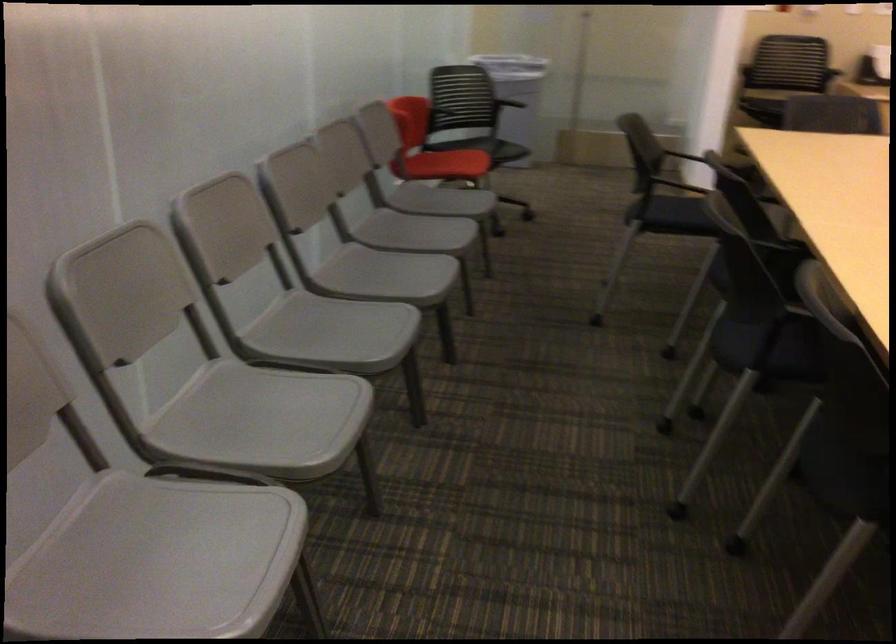
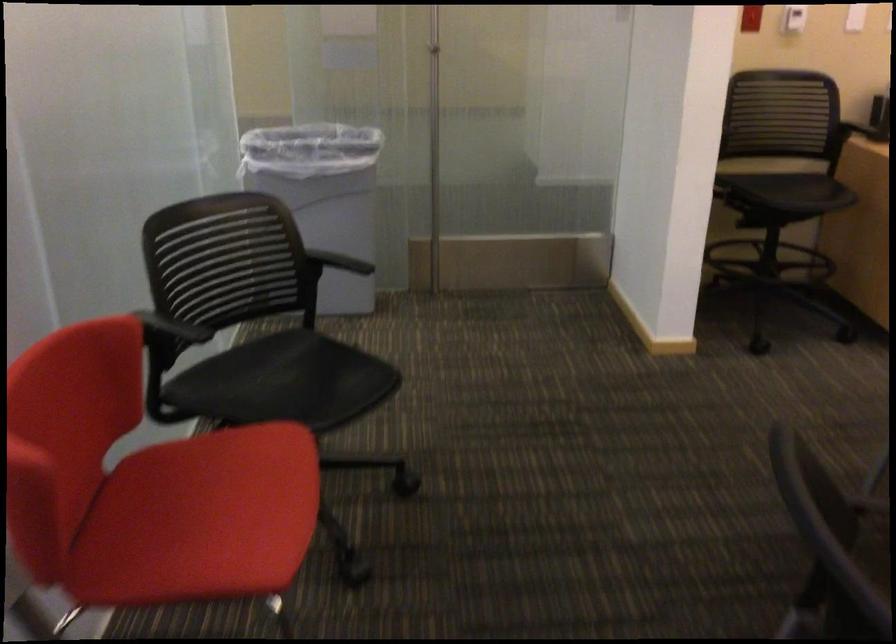
Locate, in the second image, the point that corresponds to [518,82] in the first image.

(323, 196)